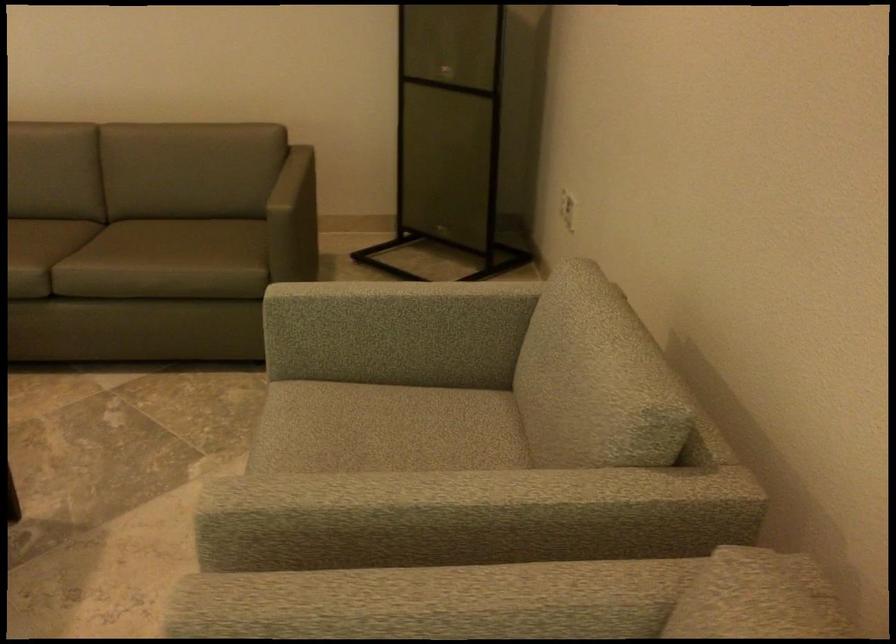
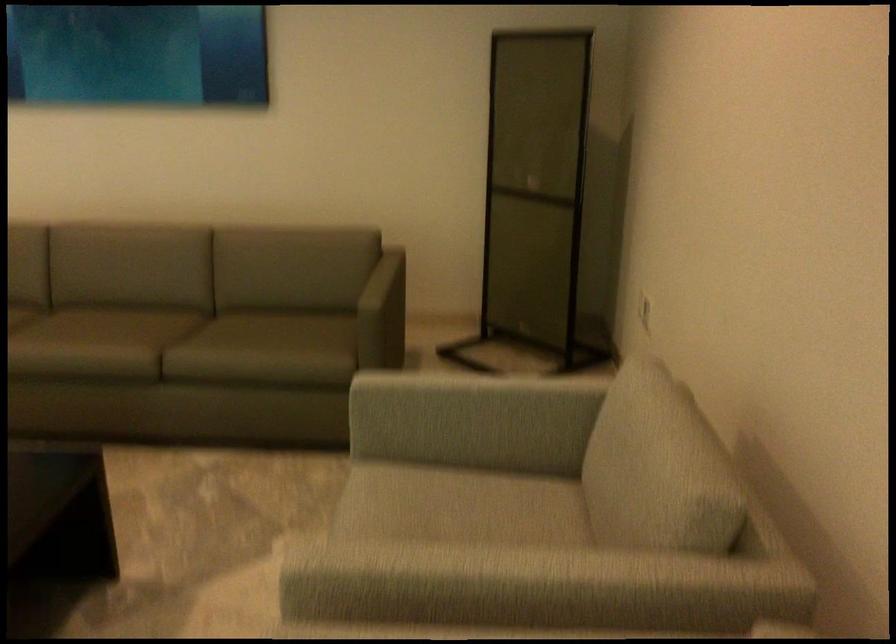
The point at [394,310] is marked in the first image. Where is the corresponding point in the second image?

(469, 399)